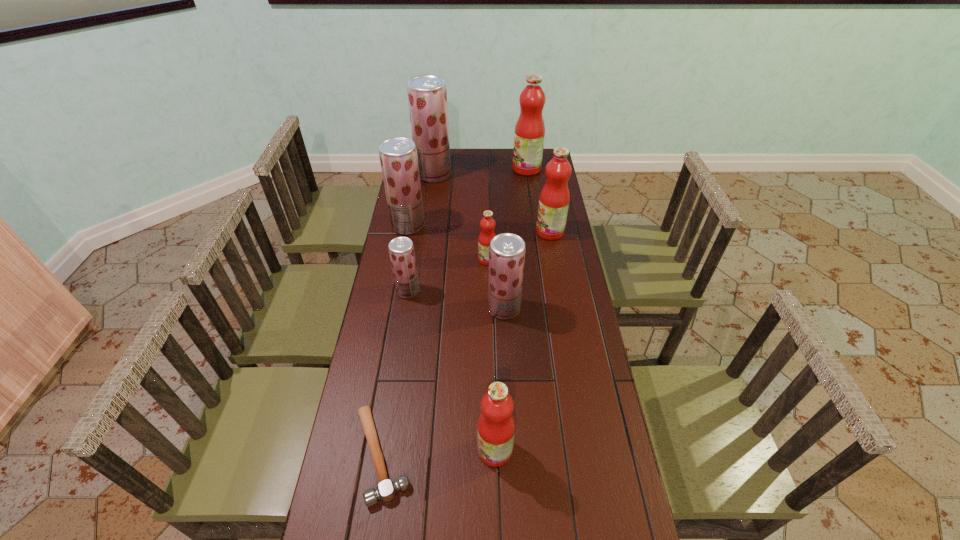
Find the location of `free space between the third nearest pink fruit juice and the hammer`. free space between the third nearest pink fruit juice and the hammer is located at coordinates (466, 343).

This screenshot has width=960, height=540. In order to click on empty space between the rightmost strawberry fruit juice and the nearest pink fruit juice in this screenshot , I will do `click(499, 379)`.

Locate an element on the screen. The height and width of the screenshot is (540, 960). vacant area between the fifth nearest object and the shortest object is located at coordinates (435, 357).

Find the location of a particular element. unoccupied position between the hammer and the third smallest pink fruit juice is located at coordinates (466, 343).

Where is `free spot between the second farthest pink fruit juice and the biggest pink fruit juice`? The height and width of the screenshot is (540, 960). free spot between the second farthest pink fruit juice and the biggest pink fruit juice is located at coordinates (539, 200).

Where is `the sixth closest object to the hammer`? the sixth closest object to the hammer is located at coordinates (554, 199).

At what (x,y) coordinates should I click in order to perform the action: click on the fourth closest object to the third smallest strawberry fruit juice. Please return your answer as a coordinate pair (x, y). The image size is (960, 540). Looking at the image, I should click on coord(507,251).

Image resolution: width=960 pixels, height=540 pixels. Find the location of `fruit juice identified as the fifth closest to the farthest strawberry fruit juice`. fruit juice identified as the fifth closest to the farthest strawberry fruit juice is located at coordinates (401, 249).

At what (x,y) coordinates should I click in order to perform the action: click on fruit juice that is the closest to the smallest strawberry fruit juice. Please return your answer as a coordinate pair (x, y). The width and height of the screenshot is (960, 540). Looking at the image, I should click on (487, 224).

Identify the location of pink fruit juice that is the third closest to the farthest strawberry fruit juice. This screenshot has width=960, height=540. (487, 224).